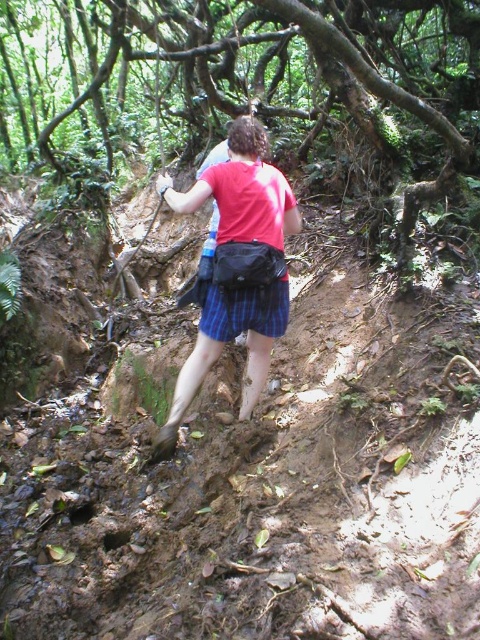
Is matte red shirt at center taller than blue striped kilt at center?

Correct, matte red shirt at center is much taller as blue striped kilt at center.

Is point (220, 179) farther from viewer compared to point (237, 326)?

No, it is not.

The width and height of the screenshot is (480, 640). What are the coordinates of `matte red shirt at center` in the screenshot? It's located at (237, 268).